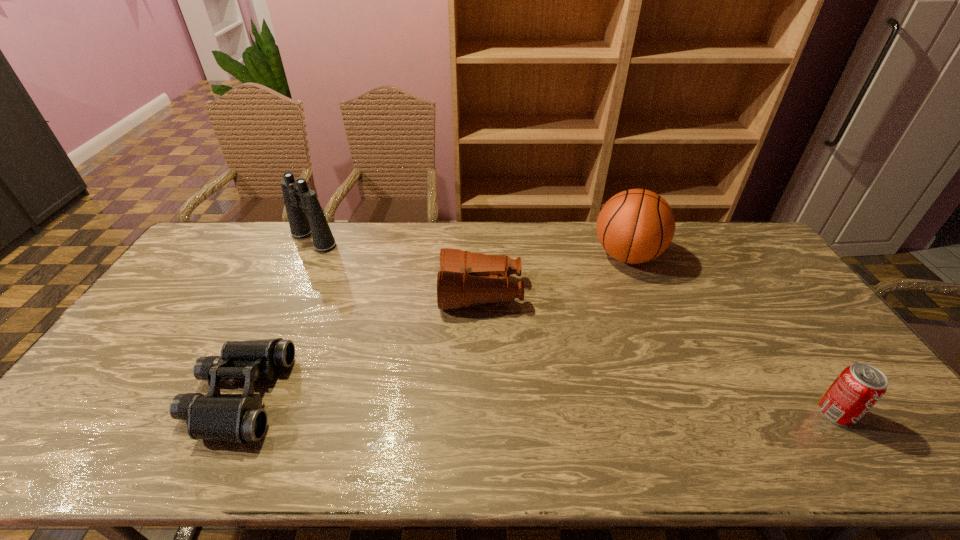
Identify the location of the tallest binoculars. The height and width of the screenshot is (540, 960). (299, 200).

The image size is (960, 540). Find the location of `basketball`. basketball is located at coordinates (634, 226).

Locate an element on the screen. The image size is (960, 540). the rightmost object is located at coordinates (856, 390).

Where is `soda can`? soda can is located at coordinates (856, 390).

Find the location of a particular element. the rightmost binoculars is located at coordinates (465, 278).

Image resolution: width=960 pixels, height=540 pixels. Identify the location of the third object from left to right. (465, 278).

Locate an element on the screen. the nearest binoculars is located at coordinates (239, 418).

I want to click on vacant space located 0.100m on the left of the tallest binoculars, so click(x=261, y=239).

Identify the location of free space located on the right of the basketball. (733, 256).

You are a GUI agent. You are given a task and a screenshot of the screen. Output one action in this format:
    pyautogui.click(x=<x>, y=<y>)
    Task: Click on the vacant space situated 0.280m on the left of the soda can
    This screenshot has height=540, width=960.
    Given the screenshot: What is the action you would take?
    pyautogui.click(x=705, y=413)